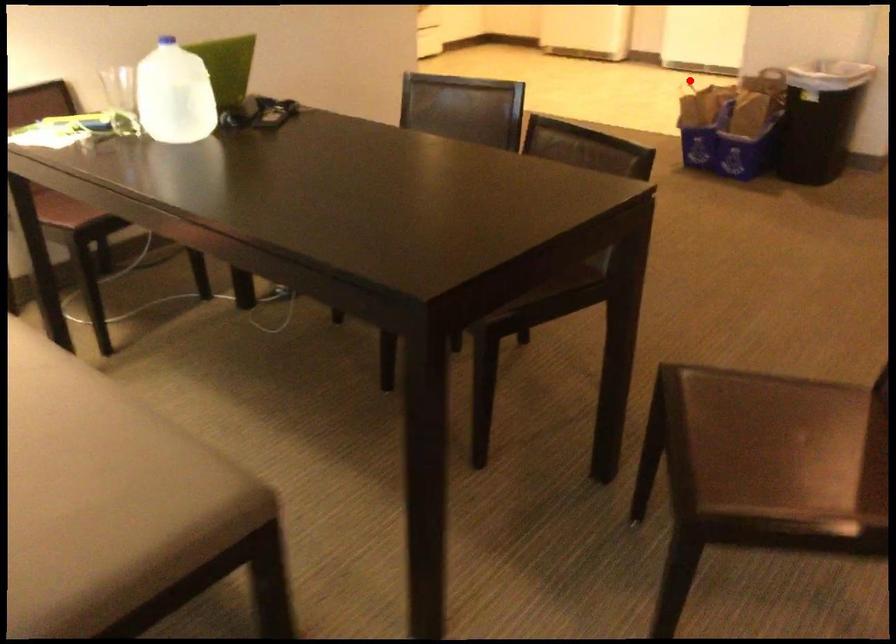
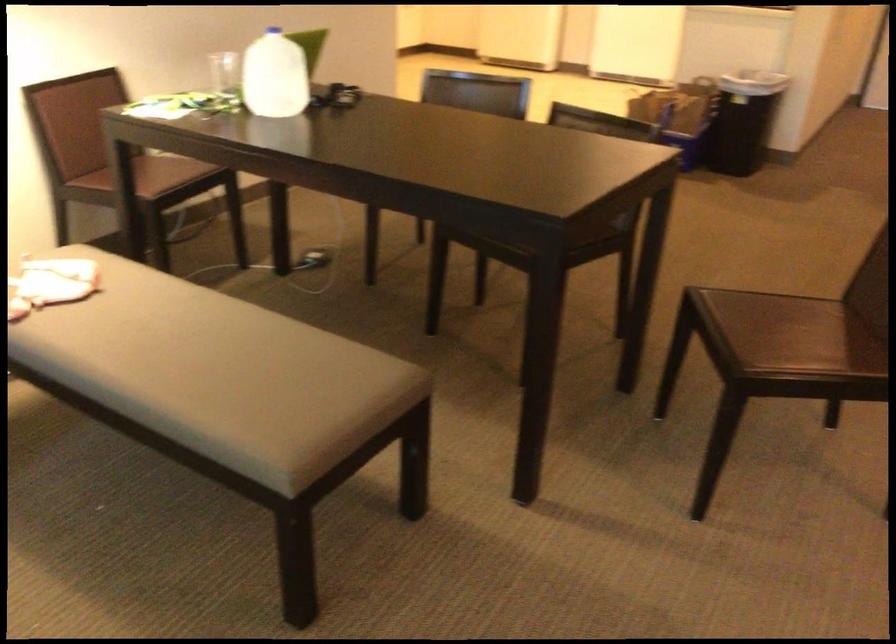
Question: I am providing you with two images of the same scene from different viewpoints. A red point is marked on the first image. Can you still see the location of the red point in image 2?

Choices:
 (A) Yes
 (B) No

Answer: (B)